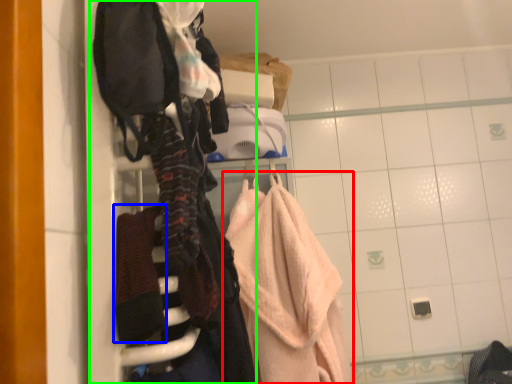
Question: Based on their relative distances, which object is nearer to towel (highlighted by a red box)? Choose from bath towel (highlighted by a blue box) and closet (highlighted by a green box).

Choices:
 (A) bath towel
 (B) closet

Answer: (B)